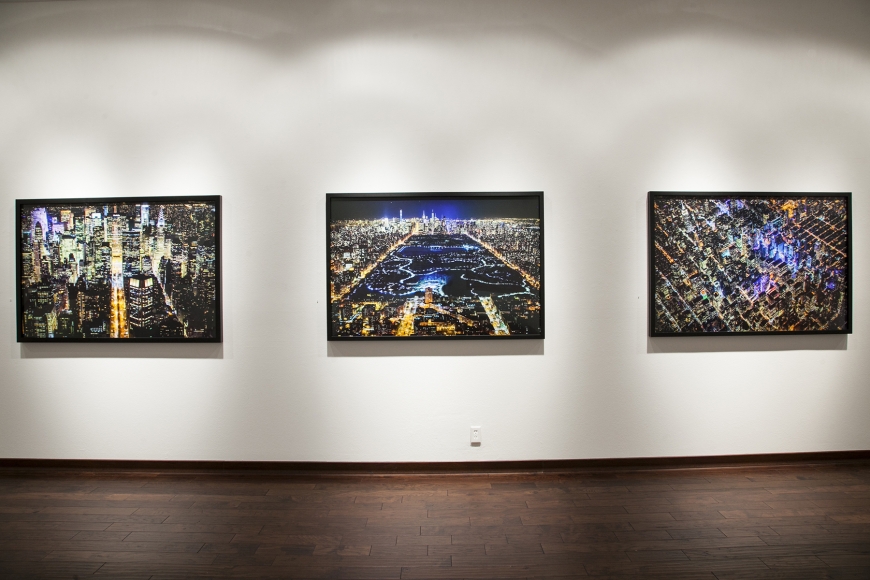
Locate an element on the screen. space between paintings is located at coordinates pyautogui.click(x=258, y=286), pyautogui.click(x=616, y=298).